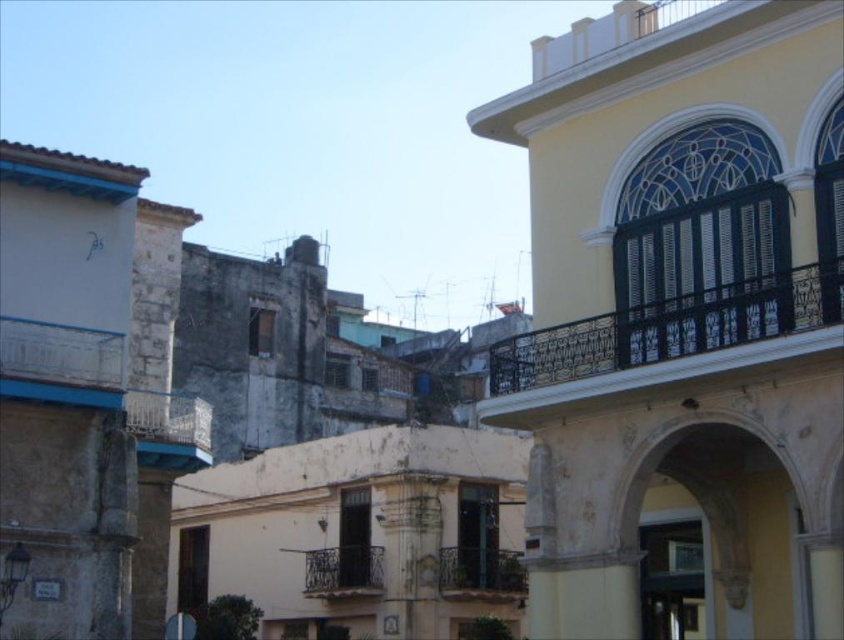
Is stone archway at center closer to the viewer compared to black wrought iron balcony at center?

Yes, stone archway at center is closer to the viewer.

Who is shorter, stone archway at center or black wrought iron balcony at center?

Standing shorter between the two is black wrought iron balcony at center.

Where is `stone archway at center`? The height and width of the screenshot is (640, 844). stone archway at center is located at coordinates (718, 534).

The width and height of the screenshot is (844, 640). What are the coordinates of `stone archway at center` in the screenshot? It's located at (718, 534).

Is stone archway at center wider than rustic metal balcony at center-left?

Correct, the width of stone archway at center exceeds that of rustic metal balcony at center-left.

Can you confirm if stone archway at center is positioned to the left of rustic metal balcony at center-left?

Incorrect, stone archway at center is not on the left side of rustic metal balcony at center-left.

What do you see at coordinates (718, 534) in the screenshot? I see `stone archway at center` at bounding box center [718, 534].

Locate an element on the screen. The image size is (844, 640). stone archway at center is located at coordinates (718, 534).

Which of these two, rustic wrought iron balcony at center or black wrought iron balcony at center, stands taller?

rustic wrought iron balcony at center

Can you confirm if rustic wrought iron balcony at center is shorter than black wrought iron balcony at center?

In fact, rustic wrought iron balcony at center may be taller than black wrought iron balcony at center.

Find the location of a particular element. rustic wrought iron balcony at center is located at coordinates (480, 570).